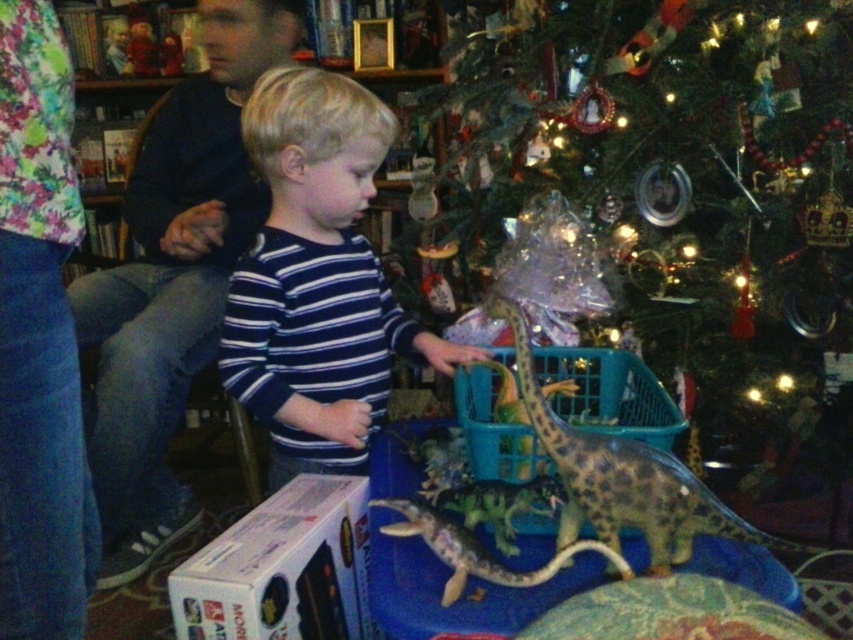
Question: Can you confirm if spotted brown toy dinosaur at lower center is positioned to the right of shiny metallic dinosaur at center?

Choices:
 (A) yes
 (B) no

Answer: (A)

Question: Does blue striped shirt at center have a smaller size compared to spotted brown toy dinosaur at lower center?

Choices:
 (A) no
 (B) yes

Answer: (A)

Question: Which point is farther to the camera?

Choices:
 (A) (817, 323)
 (B) (302, 179)
 (C) (578, 448)
 (D) (474, 548)

Answer: (A)

Question: Which point appears closest to the camera in this image?

Choices:
 (A) (469, 253)
 (B) (469, 541)

Answer: (B)

Question: Is shiny green tree at center positioned in front of shiny metallic dinosaur at center?

Choices:
 (A) no
 (B) yes

Answer: (A)

Question: Estimate the real-world distances between objects in this image. Which object is farther from the shiny metallic dinosaur at center?

Choices:
 (A) spotted brown toy dinosaur at lower center
 (B) shiny green tree at center

Answer: (B)